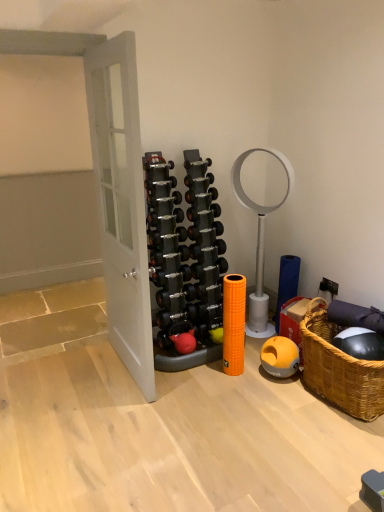
Locate an element on the screen. free space in front of rubberized black dumbbells at center, placed as the tenth dumbbell when sorted from top to bottom is located at coordinates (207, 395).